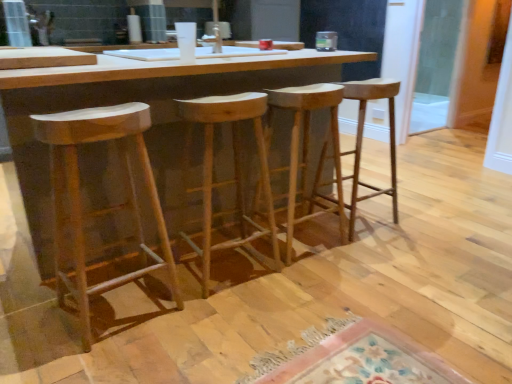
Question: Is natural wood stool at center, acting as the fourth stool starting from the left, wider or thinner than transparent glass door at right?

Choices:
 (A) thin
 (B) wide

Answer: (B)

Question: From a real-world perspective, is natural wood stool at center, the 1th stool in the right-to-left sequence, above or below transparent glass door at right?

Choices:
 (A) below
 (B) above

Answer: (A)

Question: Based on their relative distances, which object is farther from the natural wood stool at center, which appears as the 3th stool when viewed from the right?

Choices:
 (A) natural wood stool at center, the 3th stool positioned from the left
 (B) natural wood stool at center, the 1th stool in the right-to-left sequence
 (C) transparent glass door at right
 (D) natural wood table at center
 (E) natural wood stool at left, which ranks as the fourth stool in right-to-left order

Answer: (C)

Question: Which object is the closest to the transparent glass door at right?

Choices:
 (A) natural wood table at center
 (B) natural wood stool at center, the 1th stool in the right-to-left sequence
 (C) natural wood stool at left, the 1th stool from the left
 (D) natural wood stool at center, the second stool viewed from the left
 (E) natural wood stool at center, the 2th stool when ordered from right to left

Answer: (B)